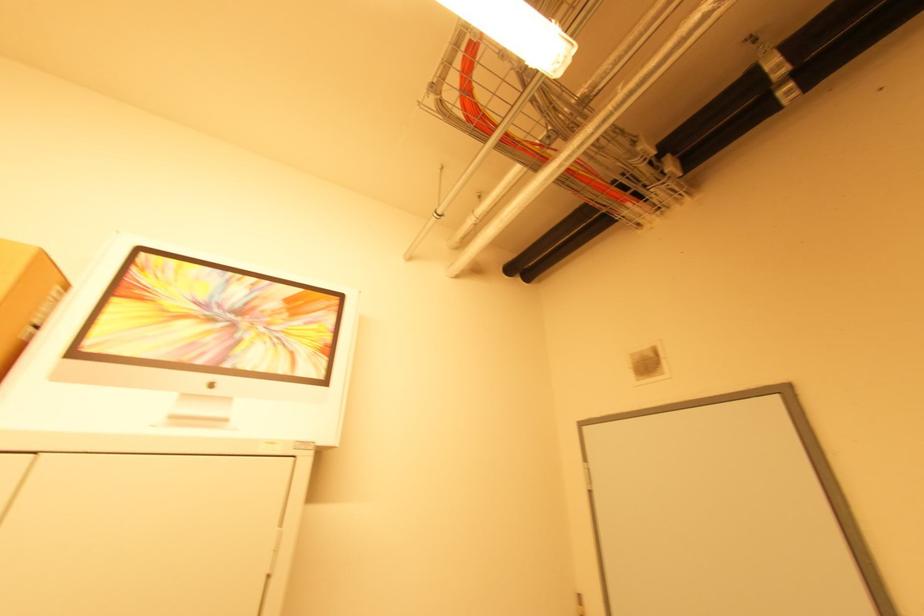
The location [25,296] corresponds to which object?

It refers to a brown cardboard box.